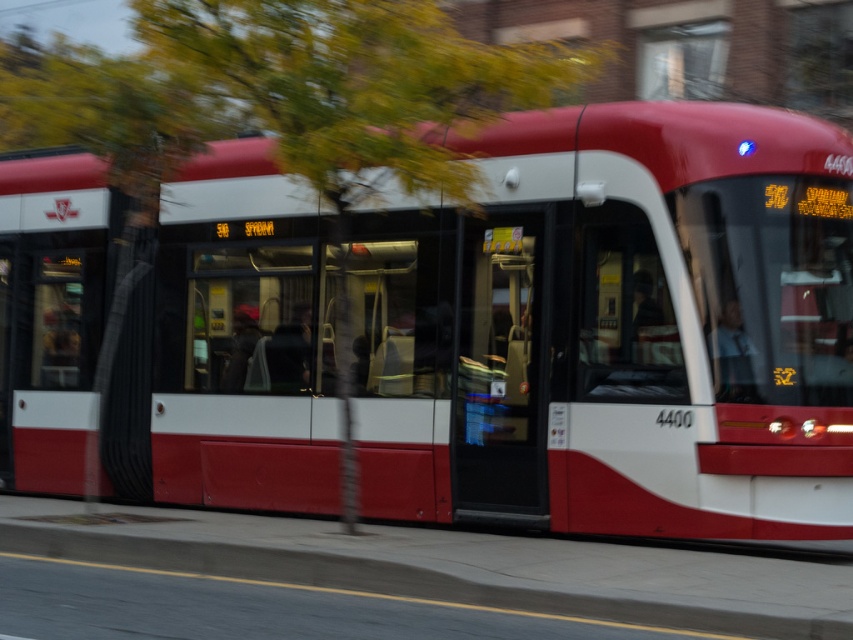
You are a photographer trying to capture the matte red bus at center and the green leafy tree at upper left in the same frame. Based on their sizes, which object would appear wider in the photo?

The matte red bus at center appears wider than the green leafy tree at upper left because its width surpasses the tree.

You are standing on the sidewalk and see a streetcar with the number 4400 on its side. The point at coordinates (618, 328) marks a specific location on the vehicle. What color is the area at that point on the matte red bus at center?

The point at coordinates (618, 328) indicates the matte red bus at center, so the area at that point is matte red.